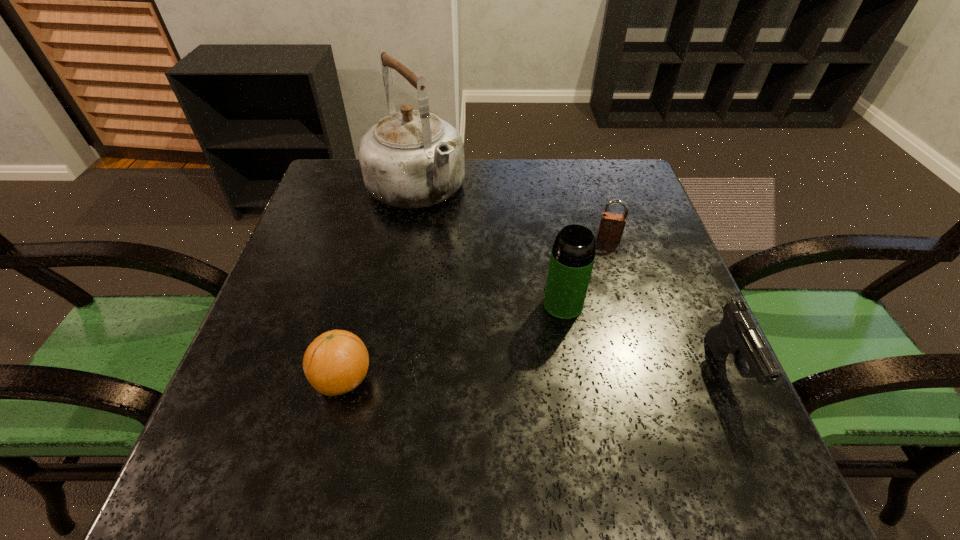
Locate an element on the screen. pistol that is at the near edge is located at coordinates (x=738, y=334).

What are the coordinates of `orange at the left edge` in the screenshot? It's located at (336, 362).

Locate an element on the screen. Image resolution: width=960 pixels, height=540 pixels. kettle situated at the left edge is located at coordinates (410, 159).

This screenshot has height=540, width=960. In order to click on pistol that is at the right edge in this screenshot , I will do `click(738, 334)`.

The image size is (960, 540). I want to click on padlock that is at the right edge, so click(x=611, y=227).

Locate an element on the screen. object that is positioned at the far left corner is located at coordinates (410, 159).

Find the location of `object at the near left corner`. object at the near left corner is located at coordinates (336, 362).

This screenshot has height=540, width=960. In order to click on object present at the near right corner in this screenshot , I will do `click(738, 334)`.

In the image, there is a desktop. Identify the location of free space at the far edge. The height and width of the screenshot is (540, 960). (396, 207).

At what (x,y) coordinates should I click in order to perform the action: click on free space at the near edge of the desktop. Please return your answer as a coordinate pair (x, y). Looking at the image, I should click on (452, 406).